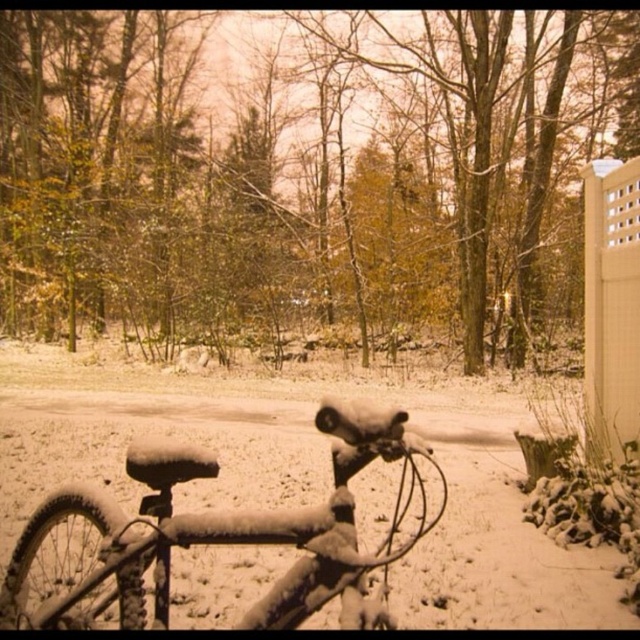
Question: Which point appears farthest from the camera in this image?

Choices:
 (A) (618, 346)
 (B) (385, 436)

Answer: (A)

Question: Is slightly frosty matte metal mountain bike at lower left to the left of white lattice fence at right from the viewer's perspective?

Choices:
 (A) yes
 (B) no

Answer: (A)

Question: Does slightly frosty matte metal mountain bike at lower left appear on the right side of white lattice fence at right?

Choices:
 (A) yes
 (B) no

Answer: (B)

Question: Which of the following is the farthest from the observer?

Choices:
 (A) white lattice fence at right
 (B) slightly frosty matte metal mountain bike at lower left

Answer: (A)

Question: Does slightly frosty matte metal mountain bike at lower left have a lesser width compared to white lattice fence at right?

Choices:
 (A) yes
 (B) no

Answer: (B)